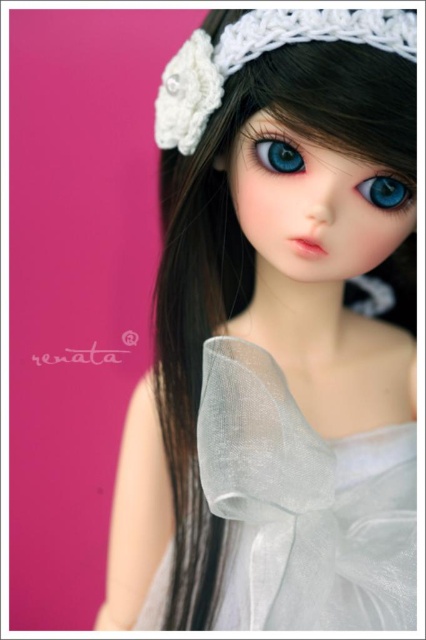
The image size is (426, 640). I want to click on translucent white fabric at center, so click(x=302, y=506).

Between point (219, 429) and point (376, 182), which one is positioned in front?

Positioned in front is point (219, 429).

Find the location of a particular element. The height and width of the screenshot is (640, 426). translucent white fabric at center is located at coordinates (302, 506).

Does blue glossy eye at upper right appear over blue glossy eye at center?

No, blue glossy eye at upper right is not above blue glossy eye at center.

Is blue glossy eye at upper right shorter than blue glossy eye at center?

Indeed, blue glossy eye at upper right has a lesser height compared to blue glossy eye at center.

Does point (385, 196) come behind point (267, 148)?

Yes.

The image size is (426, 640). Identify the location of blue glossy eye at upper right. (385, 192).

Can you confirm if satin white dress at center is thinner than blue glossy eye at center?

In fact, satin white dress at center might be wider than blue glossy eye at center.

What do you see at coordinates (273, 339) in the screenshot?
I see `satin white dress at center` at bounding box center [273, 339].

Does point (342, 163) lie behind point (268, 144)?

No, it is not.

Identify the location of satin white dress at center. (273, 339).